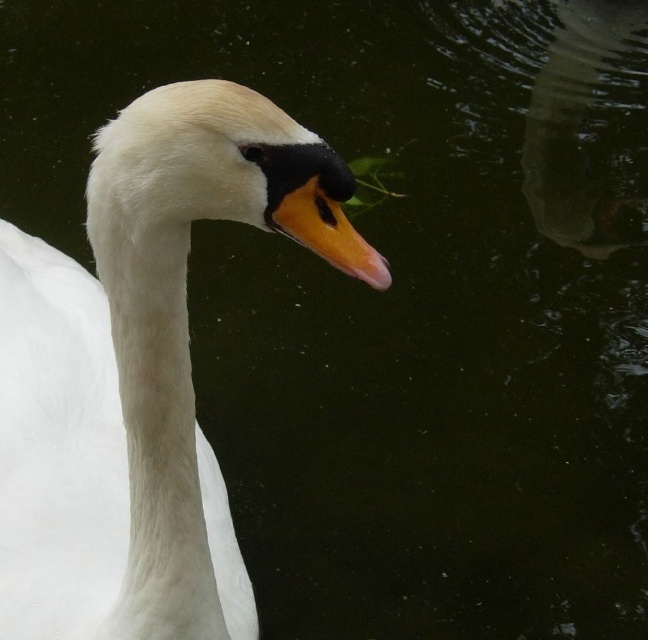
Question: Does white feathered swan at center appear over orange glossy beak at center?

Choices:
 (A) no
 (B) yes

Answer: (A)

Question: Does white feathered swan at center have a smaller size compared to orange glossy beak at center?

Choices:
 (A) no
 (B) yes

Answer: (A)

Question: Which of the following is the farthest from the observer?

Choices:
 (A) white feathered swan at center
 (B) orange glossy beak at center

Answer: (A)

Question: Which point is farther from the camera taking this photo?

Choices:
 (A) (163, 196)
 (B) (332, 264)

Answer: (A)

Question: Does white feathered swan at center have a larger size compared to orange glossy beak at center?

Choices:
 (A) no
 (B) yes

Answer: (B)